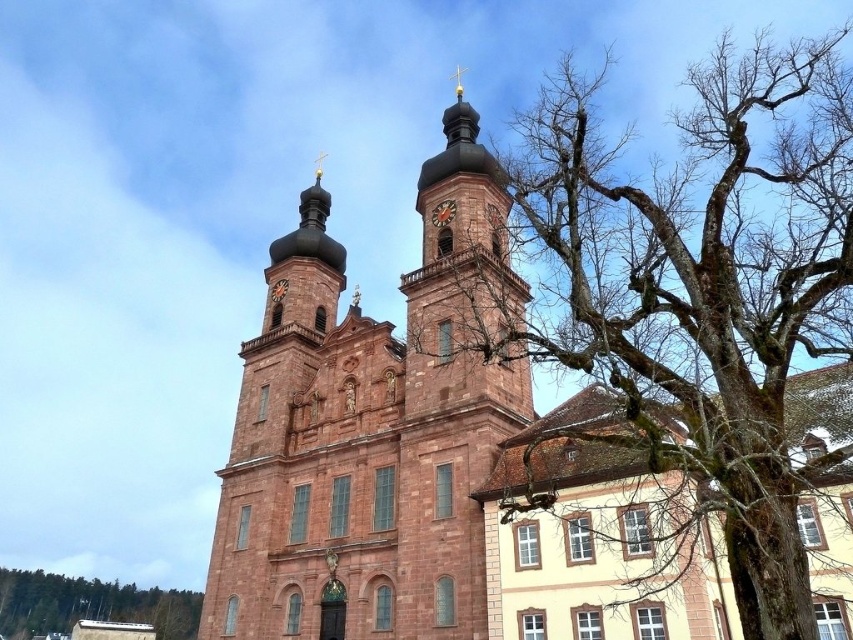
You are standing in front of the church and notice a bare wood tree at lower left and a gold metallic clock at upper center. Which object appears taller in the image?

The bare wood tree at lower left is much taller than the gold metallic clock at upper center.